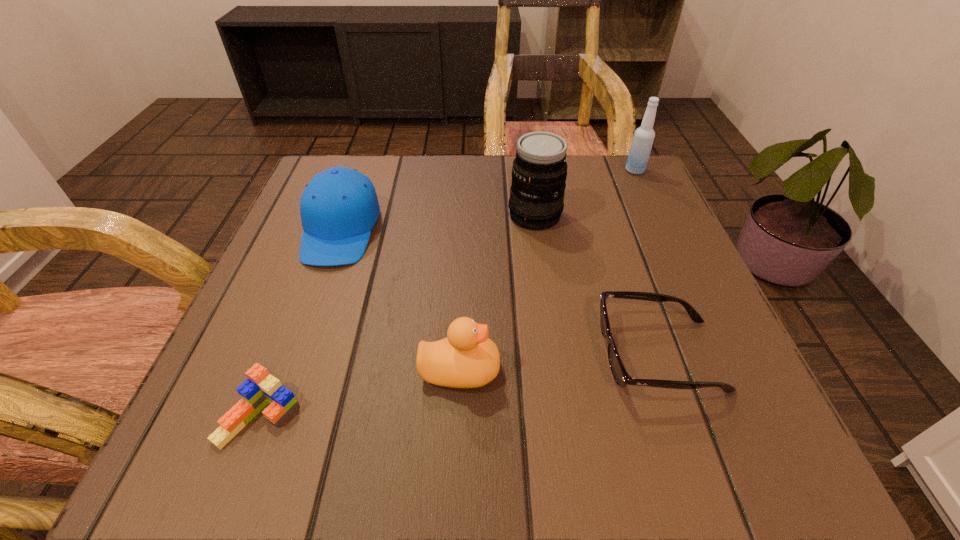
The width and height of the screenshot is (960, 540). I want to click on the farthest object, so click(x=642, y=142).

The height and width of the screenshot is (540, 960). I want to click on telephoto lens, so [x=539, y=172].

Find the location of a particular element. The width and height of the screenshot is (960, 540). cap is located at coordinates (339, 207).

I want to click on duck, so click(466, 358).

What are the coordinates of `spectacles` in the screenshot? It's located at (x=622, y=378).

The image size is (960, 540). In order to click on Lego in this screenshot , I will do (261, 388).

Identify the location of free space located 0.280m on the left of the farthest object. This screenshot has width=960, height=540. (506, 171).

Identify the location of vacant space located on the right of the third object from right to left. click(659, 215).

At what (x,y) coordinates should I click in order to perform the action: click on vacant region located on the front-facing side of the cap. Please return your answer as a coordinate pair (x, y). This screenshot has width=960, height=540. Looking at the image, I should click on (318, 294).

What are the coordinates of `free space located 0.150m on the face of the fourth object from right to left` in the screenshot? It's located at (601, 369).